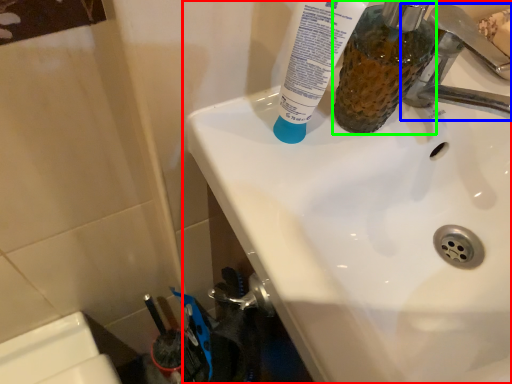
Question: Which is nearer to the sink (highlighted by a red box)? tap (highlighted by a blue box) or mouthwash (highlighted by a green box).

Choices:
 (A) tap
 (B) mouthwash

Answer: (B)